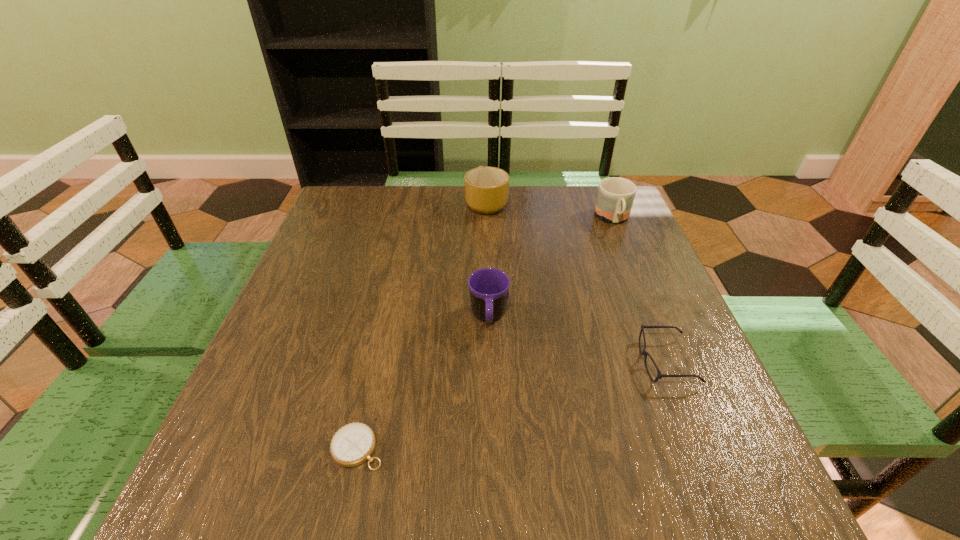
Where is `free space at the near right corner of the desktop`? This screenshot has width=960, height=540. free space at the near right corner of the desktop is located at coordinates (751, 463).

The width and height of the screenshot is (960, 540). What are the coordinates of `vacant area between the rightmost mug and the nearest mug` in the screenshot? It's located at (551, 268).

Image resolution: width=960 pixels, height=540 pixels. I want to click on vacant point located between the nearest mug and the rightmost mug, so click(551, 268).

Locate an element on the screen. The height and width of the screenshot is (540, 960). free space between the spectacles and the shortest object is located at coordinates (512, 405).

Image resolution: width=960 pixels, height=540 pixels. I want to click on free space that is in between the leftmost object and the rightmost mug, so click(x=486, y=333).

Identify the location of vacant region between the nearest mug and the leftmost object. (423, 383).

This screenshot has height=540, width=960. What are the coordinates of `vacant point located between the leftmost object and the fourth tallest object` in the screenshot? It's located at (512, 405).

Identify which object is located as the third nearest to the spectacles. Please provide its 2D coordinates. Your answer should be formatted as a tuple, i.e. [(x, y)], where the tuple contains the x and y coordinates of a point satisfying the conditions above.

[(353, 444)]

Where is `the fourth closest object to the nearest mug`? The height and width of the screenshot is (540, 960). the fourth closest object to the nearest mug is located at coordinates (615, 197).

Identify the location of mug that is the closest to the nearest mug. (486, 188).